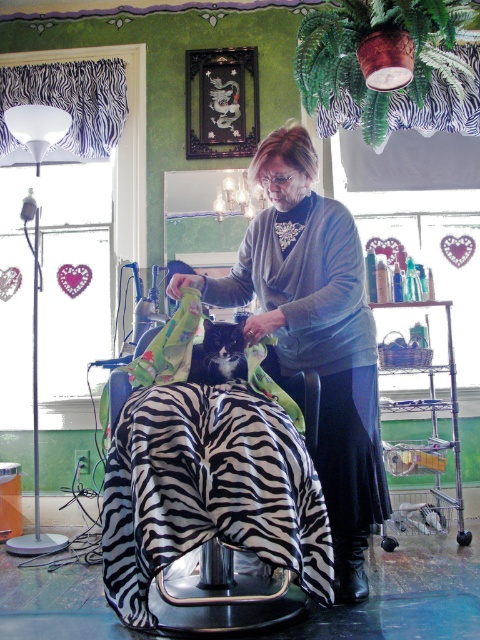
You are a customer entering the pet grooming salon and see the matte gray sweater at center and the black fur cat at center. Which object is closer to the floor?

The matte gray sweater at center is positioned under the black fur cat at center, so it is closer to the floor.

You are a customer in the pet grooming salon and want to place a small gift on the counter between the matte gray sweater at center and the black fur cat at center. Is there enough space between them to fit the gift?

The matte gray sweater at center is positioned on the right side of the black fur cat at center, so there is space between them to place the gift.

You are a pet owner who wants to know if the matte gray sweater at center can be used to cover the black fur cat at center completely. Based on the scene description, can the sweater be large enough?

The matte gray sweater at center is larger in size than black fur cat at center, so yes, the sweater can be large enough to cover the cat completely.